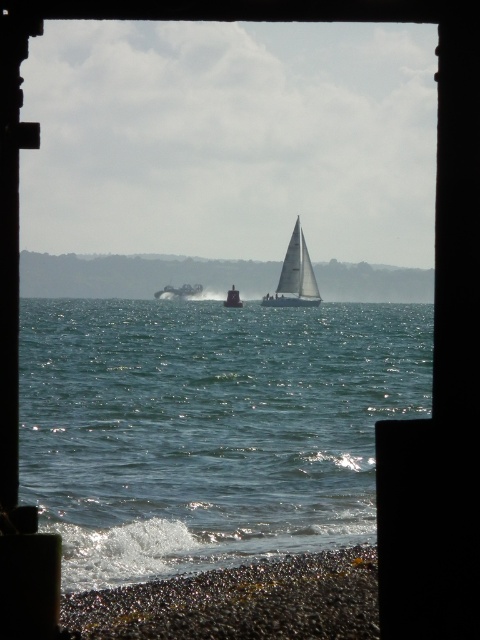
Can you confirm if white sailboat at center is positioned below metallic silver boat at center?

Indeed, white sailboat at center is positioned under metallic silver boat at center.

Is white sailboat at center to the right of metallic silver boat at center from the viewer's perspective?

Yes, white sailboat at center is to the right of metallic silver boat at center.

Does point (276, 300) lie behind point (164, 292)?

No.

The image size is (480, 640). I want to click on white sailboat at center, so click(295, 275).

Which is in front, point (365, 285) or point (192, 291)?

Positioned in front is point (192, 291).

Does white matte horizon at center have a greater width compared to metallic silver boat at center?

Yes, white matte horizon at center is wider than metallic silver boat at center.

I want to click on white matte horizon at center, so click(137, 275).

Does point (248, 282) lie behind point (305, 257)?

Yes, it is.

How far apart are white matte horizon at center and white sailboat at center?

Answer: white matte horizon at center is 158.78 meters away from white sailboat at center.

Between point (389, 300) and point (264, 300), which one is positioned behind?

Point (389, 300)

Find the location of a particular element. Image resolution: width=480 pixels, height=640 pixels. white matte horizon at center is located at coordinates (137, 275).